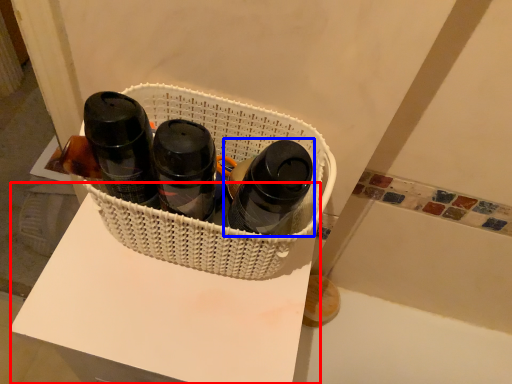
Question: Which object appears closest to the camera in this image, table (highlighted by a red box) or bottle (highlighted by a blue box)?

Choices:
 (A) table
 (B) bottle

Answer: (B)